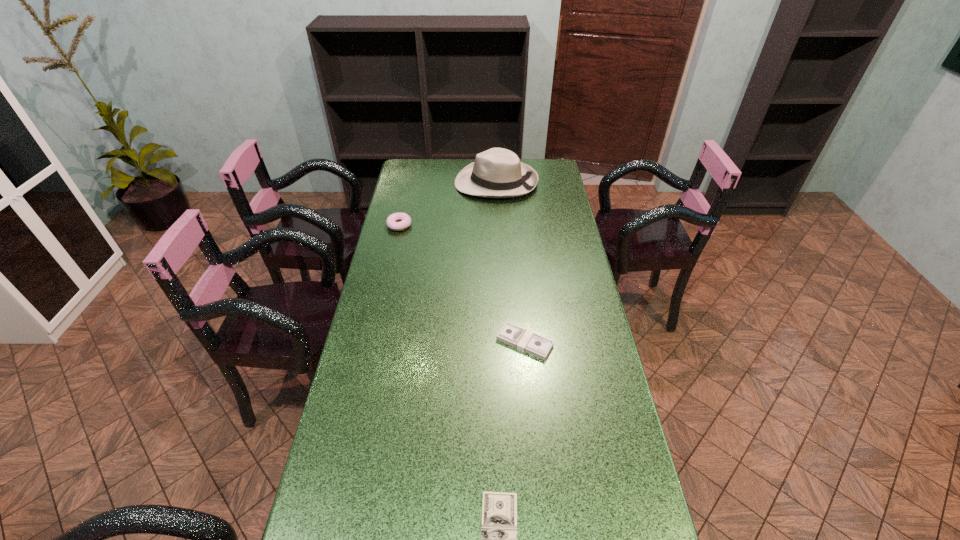
Find the location of a particular element. the tallest object is located at coordinates (496, 173).

Identify the location of the farthest object. [x=496, y=173].

This screenshot has width=960, height=540. What are the coordinates of `the leftmost object` in the screenshot? It's located at (405, 220).

Where is `doughnut`? doughnut is located at coordinates (405, 220).

Identify the location of the second shortest object. Image resolution: width=960 pixels, height=540 pixels. (513, 335).

The height and width of the screenshot is (540, 960). Find the location of `the second nearest object`. the second nearest object is located at coordinates (513, 335).

The width and height of the screenshot is (960, 540). In order to click on vacant area situated 0.130m on the front-facing side of the fedora in this screenshot , I will do `click(425, 183)`.

Locate an element on the screen. This screenshot has height=540, width=960. free spot located on the front-facing side of the fedora is located at coordinates (408, 183).

You are a GUI agent. You are given a task and a screenshot of the screen. Output one action in this format:
    pyautogui.click(x=<x>, y=<y>)
    Task: Click on the vacant space located 0.240m on the front-facing side of the fedora
    
    Given the screenshot: What is the action you would take?
    pyautogui.click(x=401, y=183)

The height and width of the screenshot is (540, 960). I want to click on vacant space located 0.120m on the front of the leftmost object, so click(393, 253).